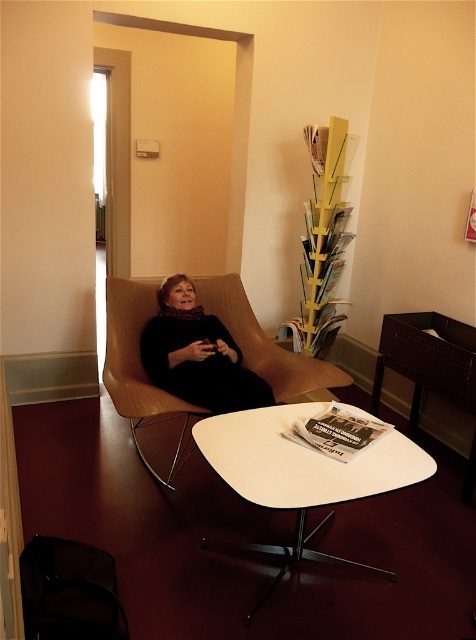
Between wooden chair at center and black soft fabric woman at center, which one has more height?

wooden chair at center is taller.

Who is more forward, (x=165, y=413) or (x=259, y=404)?

Point (x=259, y=404) is in front.

Identify the location of wooden chair at center. This screenshot has width=476, height=640. (139, 369).

Is wooden chair at center smaller than black glossy magazine at center?

Incorrect, wooden chair at center is not smaller in size than black glossy magazine at center.

Does point (142, 314) come behind point (295, 429)?

Yes, point (142, 314) is farther from viewer.

Locate an element on the screen. The width and height of the screenshot is (476, 640). wooden chair at center is located at coordinates (139, 369).

Is white glossy table at center bigger than wooden chair at center?

No.

Does white glossy table at center appear on the left side of wooden chair at center?

Incorrect, white glossy table at center is not on the left side of wooden chair at center.

Find the location of `white glossy table at center`. white glossy table at center is located at coordinates (299, 472).

The height and width of the screenshot is (640, 476). Find the location of `white glossy table at center`. white glossy table at center is located at coordinates (299, 472).